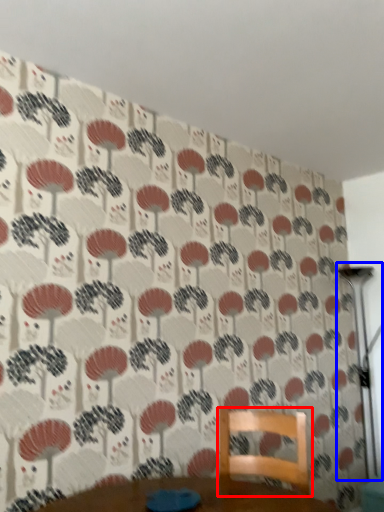
Question: Which of the following is the closest to the observer, furniture (highlighted by a red box) or table lamp (highlighted by a blue box)?

Choices:
 (A) furniture
 (B) table lamp

Answer: (A)